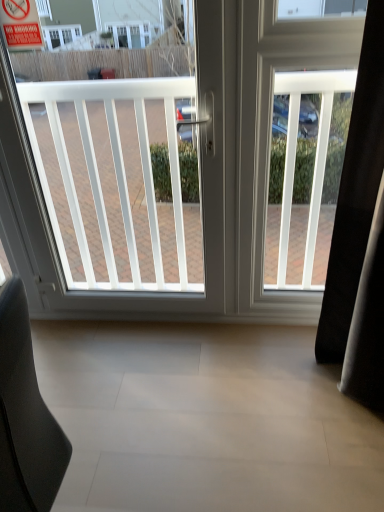
You are a GUI agent. You are given a task and a screenshot of the screen. Output one action in this format:
    pyautogui.click(x=<x>, y=<y>)
    Task: Click on the vacant area that is in front of white plastic window at center
    The image size is (384, 512).
    Given the screenshot: What is the action you would take?
    pyautogui.click(x=142, y=392)